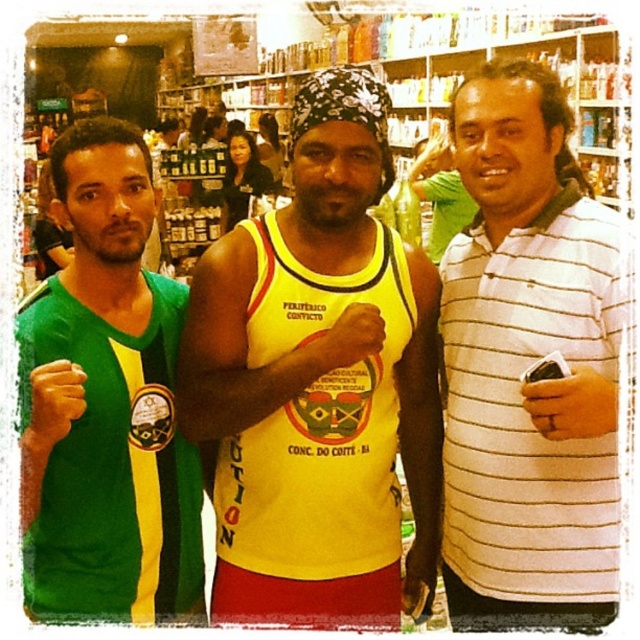
You are a store employee who needs to find the white striped polo shirt at right for a customer. Based on the store layout described, where should you look relative to the other people in the image?

The white striped polo shirt at right is located at point (529, 364), which is to the right of the central figure and near the foreground shelves.

You are standing in the convenience store and see the three people in the scene. The person on the left is wearing a green and yellow sports jersey with a circular emblem on the chest. The central figure is wearing a yellow tank top with red and black trim. Where is the point located at coordinates [317,378] in relation to the people?

The point at coordinates [317,378] corresponds to the yellow fabric tank top at center, which is the central figure wearing the yellow tank top with red and black trim.

You are a store employee who needs to place a new tag on the clothing items. The tag must be placed on the wider clothing item between the yellow fabric tank top at center and the white striped polo shirt at right. Which clothing item should you choose?

The yellow fabric tank top at center is wider than the white striped polo shirt at right, so the tag should be placed on the yellow fabric tank top at center.